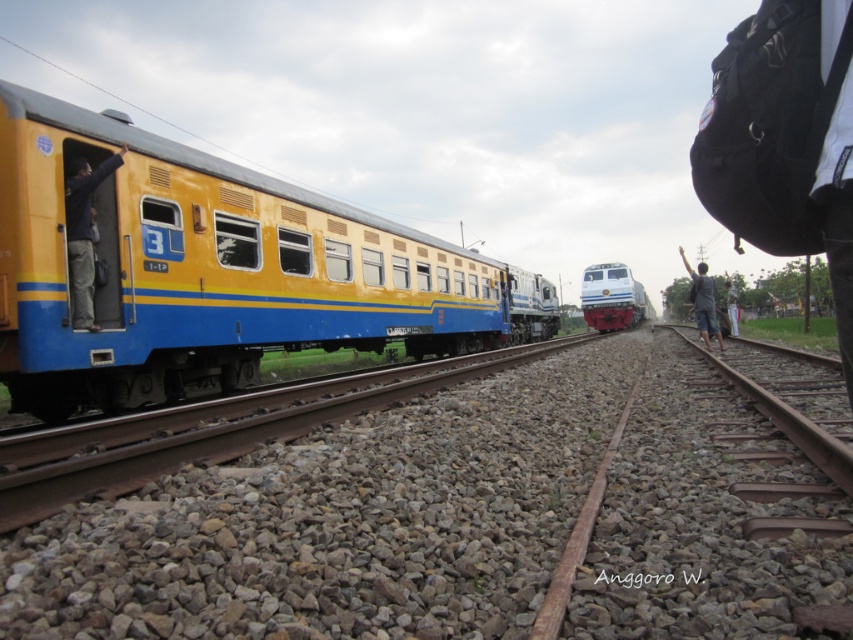
Question: Can you confirm if dark blue fabric jacket at left is thinner than white glossy locomotive at center?

Choices:
 (A) yes
 (B) no

Answer: (A)

Question: Which object is positioned closest to the rusty metal train track at lower center?

Choices:
 (A) dark blue fabric jacket at left
 (B) white cotton pants at right

Answer: (A)

Question: Among these points, which one is nearest to the camera?

Choices:
 (A) (383, 376)
 (B) (76, 209)
 (C) (625, 268)

Answer: (B)

Question: From the image, what is the correct spatial relationship of dark blue fabric jacket at left in relation to white glossy locomotive at center?

Choices:
 (A) above
 (B) below

Answer: (B)

Question: Which object appears closest to the camera in this image?

Choices:
 (A) white glossy locomotive at center
 (B) dark gray fabric pants at right
 (C) dark blue fabric jacket at left

Answer: (C)

Question: Is dark gray fabric pants at right further to camera compared to white cotton pants at right?

Choices:
 (A) yes
 (B) no

Answer: (B)